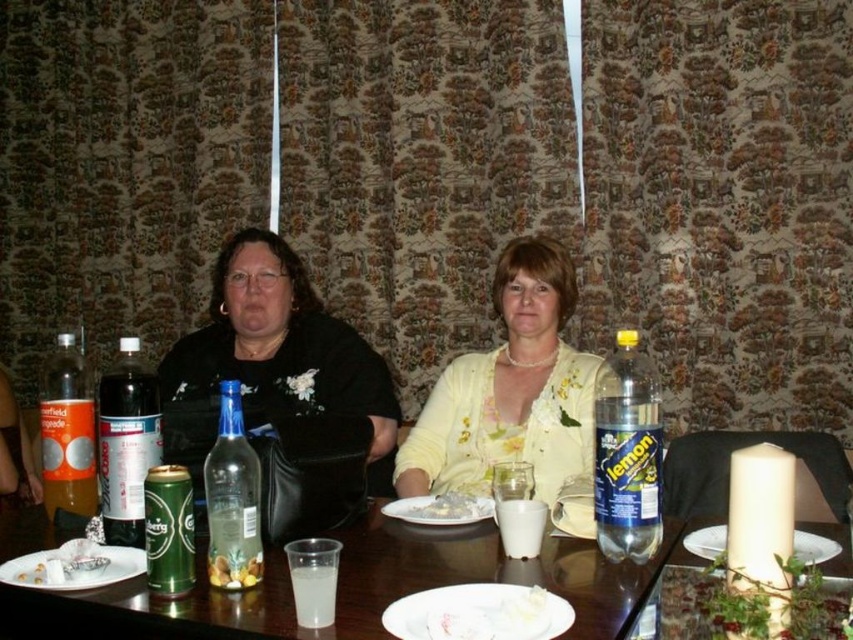
You are a person standing in front of the table in the image. You want to grab the orange matte soda at lower left. Can you reach it without moving your feet?

The orange matte soda at lower left is 4.75 feet away from viewer, which is about 57 inches. Since the average human arm length is around 25 to 30 inches, you cannot reach it without moving your feet.

You are setting up a small snack table for two guests. You have a white matte plate at center and transparent plastic cups at lower center. According to the scene, where should you place the cups in relation to the plate to match the arrangement shown?

The transparent plastic cups at lower center should be placed below the white matte plate at center to match the arrangement shown.

You are a server at a restaurant and need to place a new order of drinks on the table. The drinks are in the transparent plastic cups at lower center. Where should you place the drinks so they are not blocking the white matte plate at center?

The transparent plastic cups at lower center should be moved away from the white matte plate at center since the cups are currently closer to the viewer than the plate, which may block the view or access to the plate.